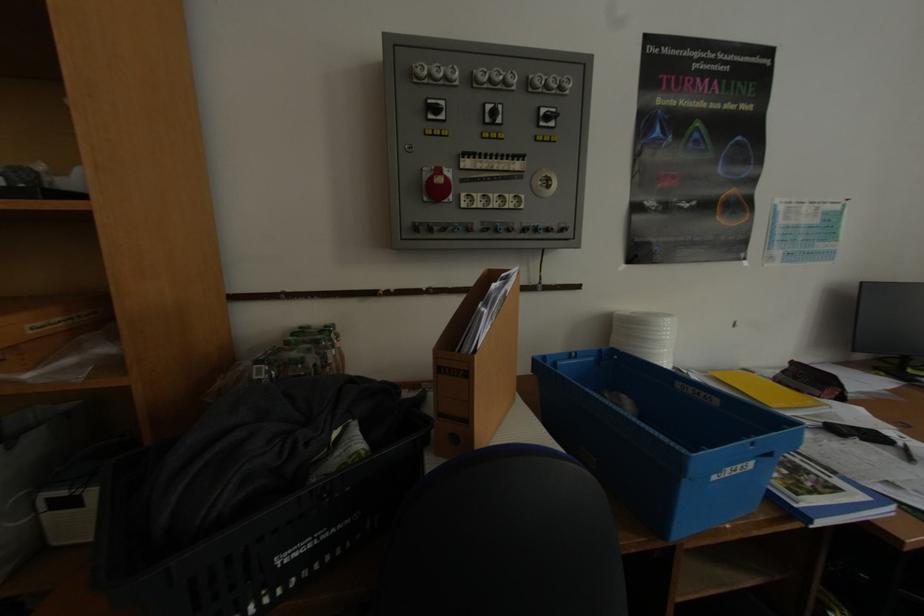
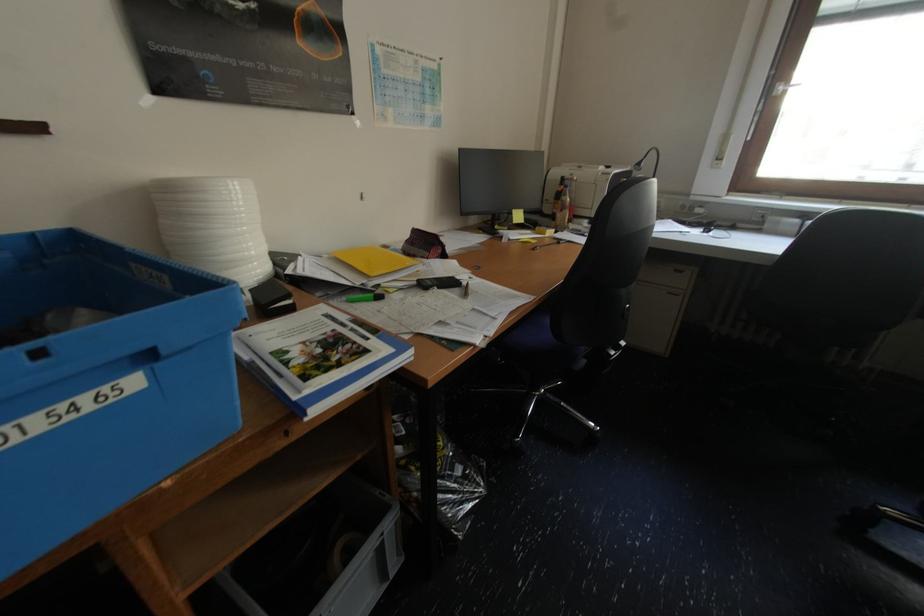
Locate, in the second image, the point that corresponds to [830,492] in the first image.

(351, 363)